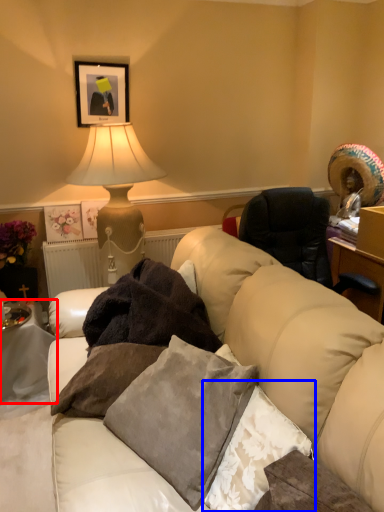
Question: Which of the following is the farthest to the observer, table (highlighted by a red box) or pillow (highlighted by a blue box)?

Choices:
 (A) table
 (B) pillow

Answer: (A)